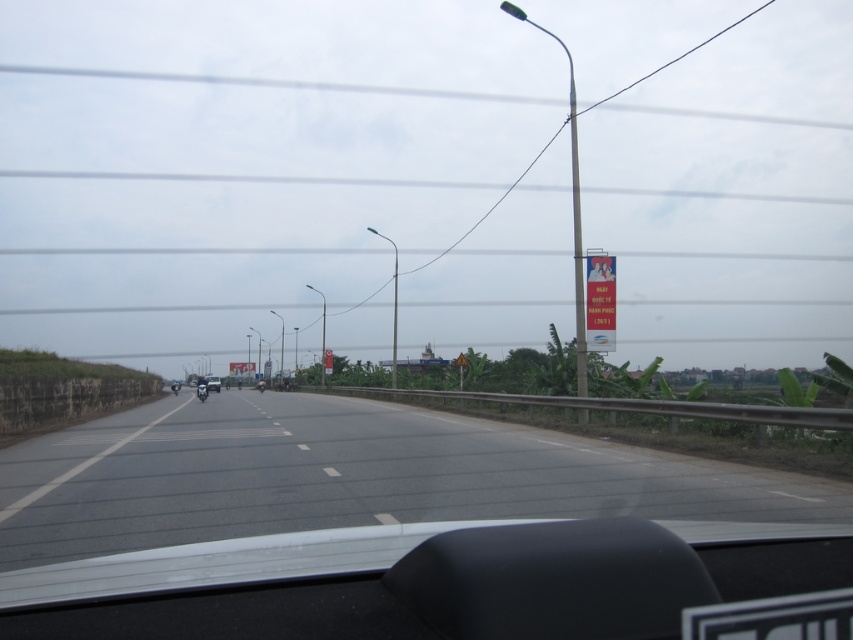
Question: Among these points, which one is farthest from the camera?

Choices:
 (A) (207, 390)
 (B) (177, 410)
 (C) (198, 387)
 (D) (576, 376)

Answer: (A)

Question: Does red plastic sign at right have a lesser width compared to shiny black motorcycle at center?

Choices:
 (A) yes
 (B) no

Answer: (A)

Question: Does red plastic sign at right have a larger size compared to metallic silver motorcycle at center?

Choices:
 (A) yes
 (B) no

Answer: (B)

Question: Which object appears farthest from the camera in this image?

Choices:
 (A) metallic pole at right
 (B) shiny black motorcycle at center
 (C) asphalt road at center

Answer: (B)

Question: Can you confirm if asphalt road at center is thinner than metallic pole at right?

Choices:
 (A) no
 (B) yes

Answer: (B)

Question: Which object is the closest to the metallic pole at right?

Choices:
 (A) black glossy motorcycle at center
 (B) metallic silver motorcycle at center
 (C) red plastic sign at right

Answer: (C)